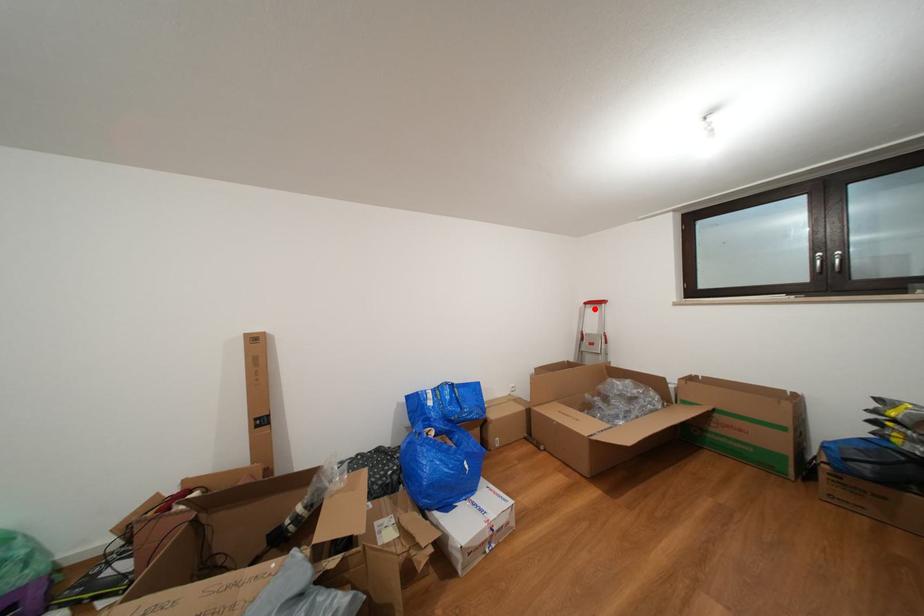
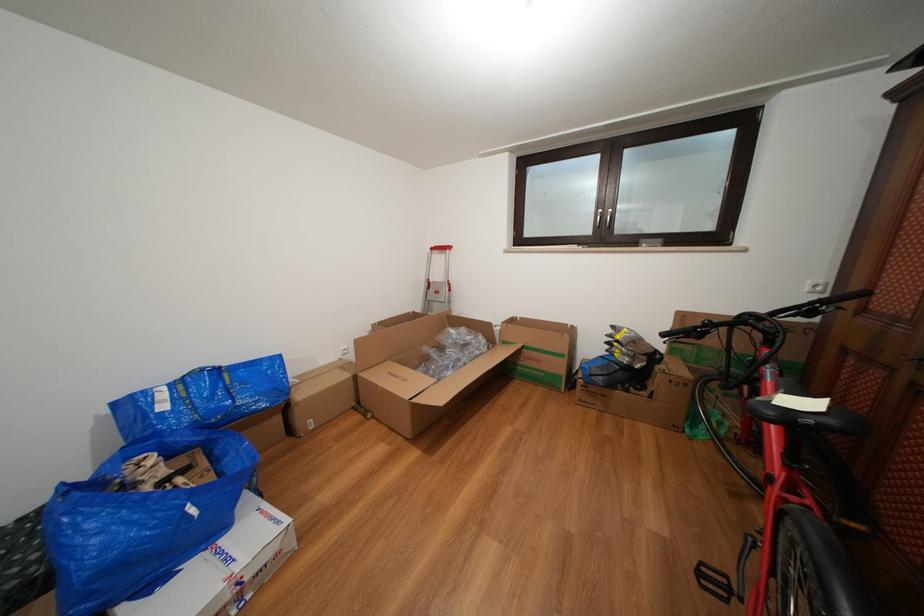
Where in the second image is the point corresponding to the highlighted location from the first image?

(441, 254)